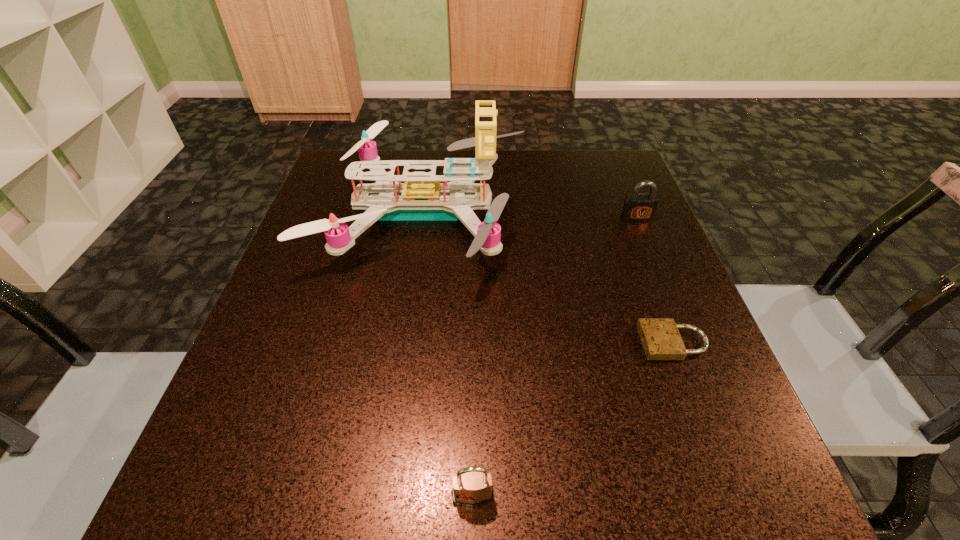
Locate an element on the screen. This screenshot has height=540, width=960. vacant space at the far left corner of the desktop is located at coordinates (344, 185).

Where is `free space at the near left corner of the desktop`? This screenshot has height=540, width=960. free space at the near left corner of the desktop is located at coordinates (224, 487).

Locate an element on the screen. free space at the far right corner of the desktop is located at coordinates (627, 167).

Locate an element on the screen. The height and width of the screenshot is (540, 960). free space at the near right corner of the desktop is located at coordinates (728, 462).

Identify the location of vacant region between the farthest padlock and the tallest object. (530, 215).

This screenshot has width=960, height=540. Find the location of `free space between the drone and the second nearest object`. free space between the drone and the second nearest object is located at coordinates (548, 278).

Locate an element on the screen. Image resolution: width=960 pixels, height=540 pixels. free space between the drone and the nearest padlock is located at coordinates (448, 354).

I want to click on unoccupied area between the drone and the nearest object, so click(448, 354).

The width and height of the screenshot is (960, 540). In order to click on free space that is in between the farthest padlock and the nearest padlock in this screenshot , I will do click(x=555, y=356).

I want to click on blank region between the third farthest object and the nearest object, so click(573, 419).